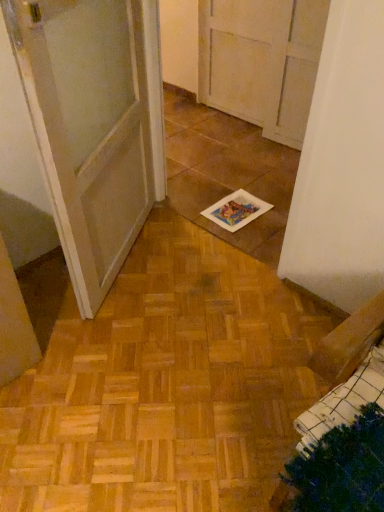
At what (x,y) coordinates should I click in order to perform the action: click on vacant region in front of white glossy door at center. Please return your answer as a coordinate pair (x, y). The width and height of the screenshot is (384, 512). Looking at the image, I should click on (135, 352).